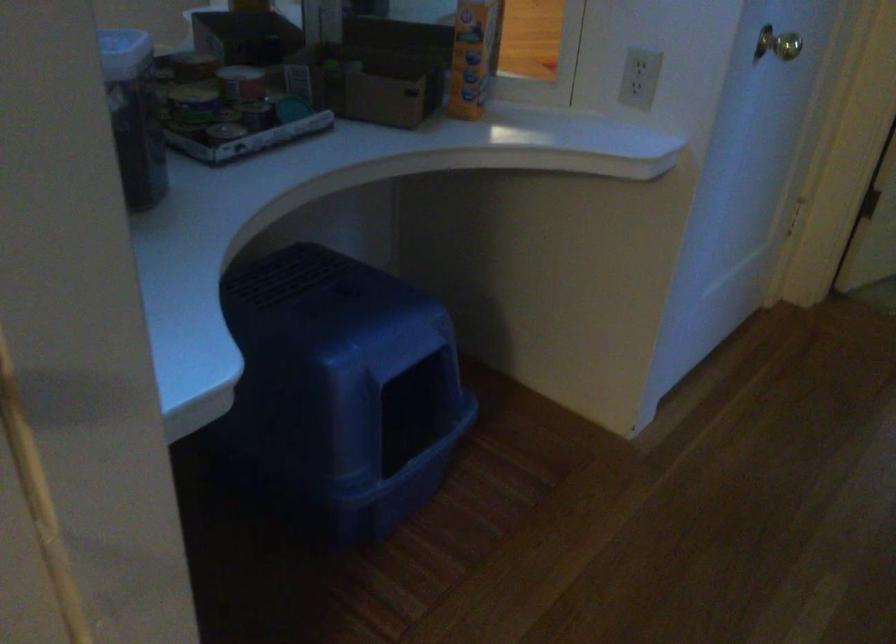
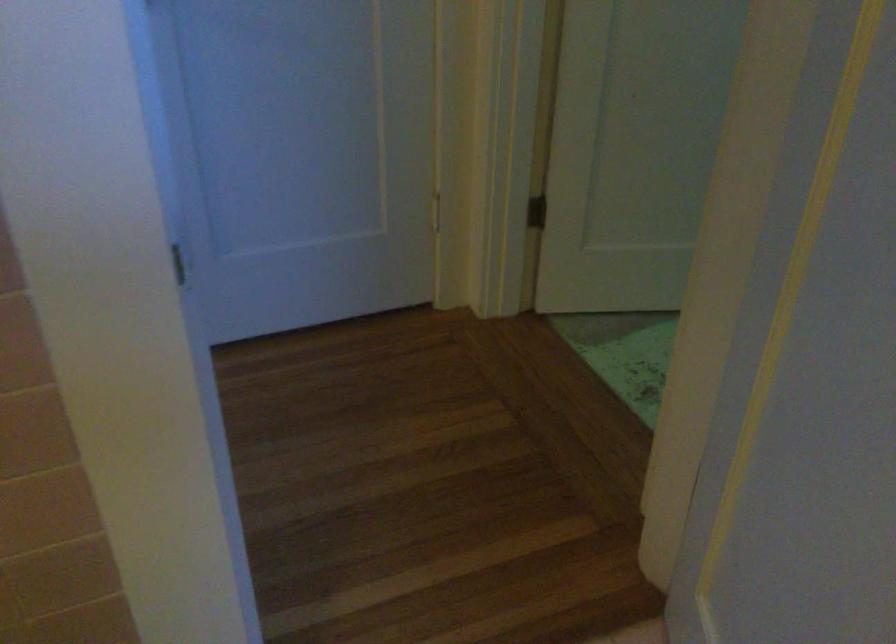
Question: In a continuous first-person perspective shot, in which direction is the camera moving?

Choices:
 (A) Left
 (B) Right
 (C) Forward
 (D) Backward

Answer: (B)